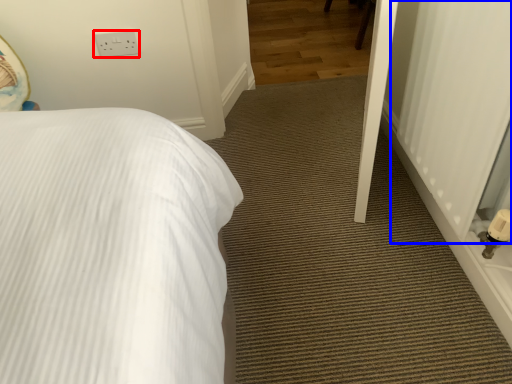
Question: Which object appears farthest to the camera in this image, electric outlet (highlighted by a red box) or screen door (highlighted by a blue box)?

Choices:
 (A) electric outlet
 (B) screen door

Answer: (A)